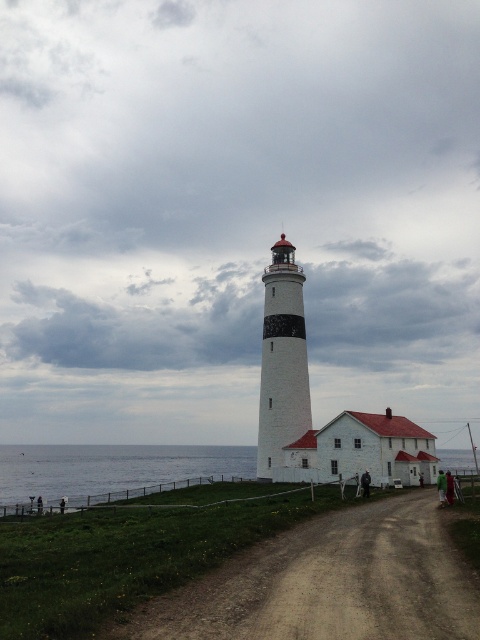
Is point (450, 598) closer to camera compared to point (292, 435)?

Yes, it is.

Which is below, brown dirt track at center or white painted brick lighthouse at center?

Positioned lower is brown dirt track at center.

Is point (207, 588) in front of point (275, 461)?

Yes, point (207, 588) is closer to viewer.

Locate an element on the screen. brown dirt track at center is located at coordinates (330, 582).

Is point (117, 448) closer to viewer compared to point (283, 332)?

No, (117, 448) is behind (283, 332).

Locate an element on the screen. The width and height of the screenshot is (480, 640). blue water at lower left is located at coordinates (109, 467).

Is point (216, 573) farther from camera compared to point (157, 454)?

That is False.

Who is more distant from viewer, (x=179, y=595) or (x=27, y=477)?

The point (x=27, y=477) is behind.

Find the location of a particular element. Image resolution: width=480 pixels, height=640 pixels. brown dirt track at center is located at coordinates (330, 582).